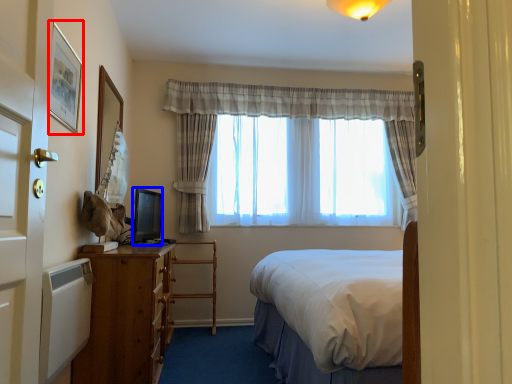
Question: Among these objects, which one is nearest to the camera, picture frame (highlighted by a red box) or television (highlighted by a blue box)?

Choices:
 (A) picture frame
 (B) television

Answer: (A)